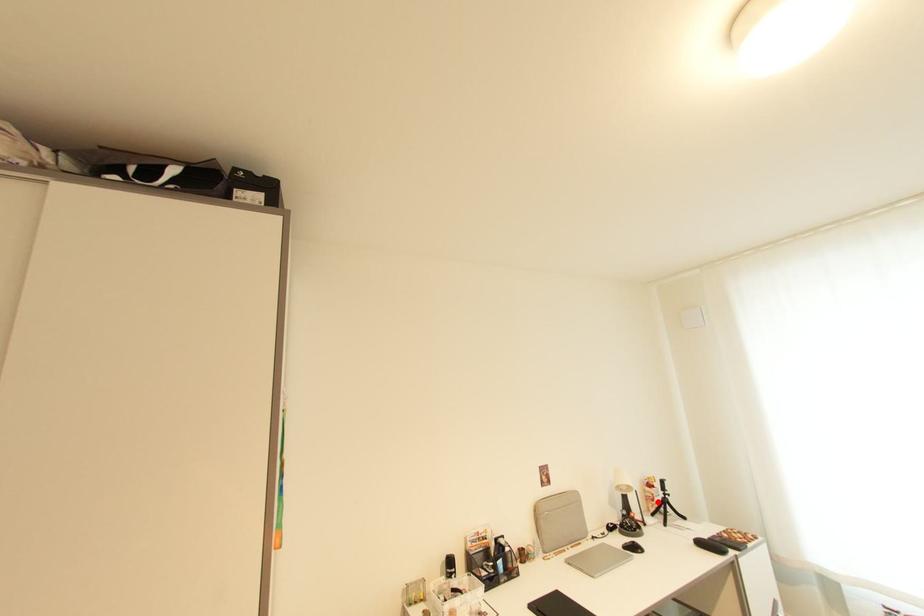
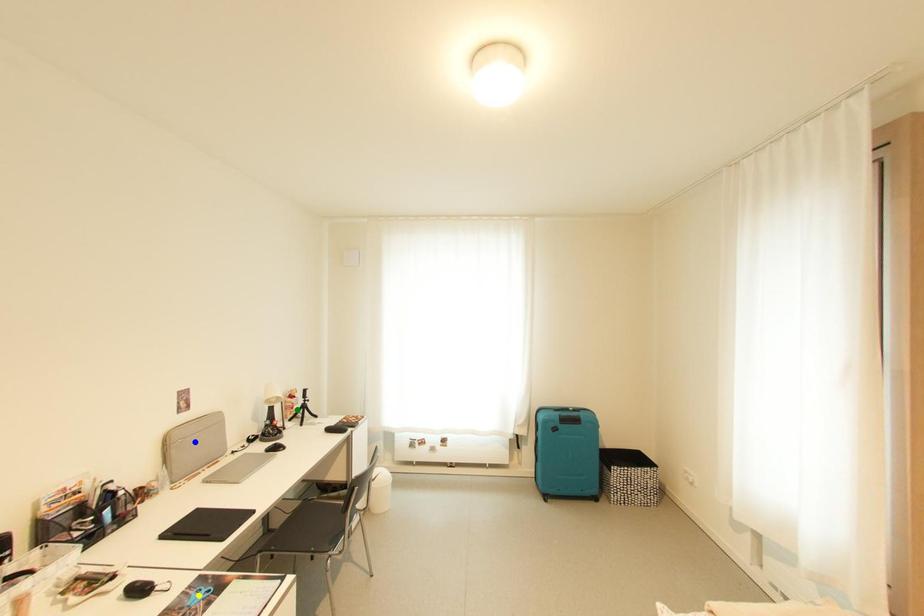
Question: I am providing you with two images of the same scene from different viewpoints. A red point is marked on the first image. You are given multiple points on the second image. In image 2, which mark is for the same physical point as the one in image 1?

Choices:
 (A) green point
 (B) yellow point
 (C) blue point

Answer: (A)